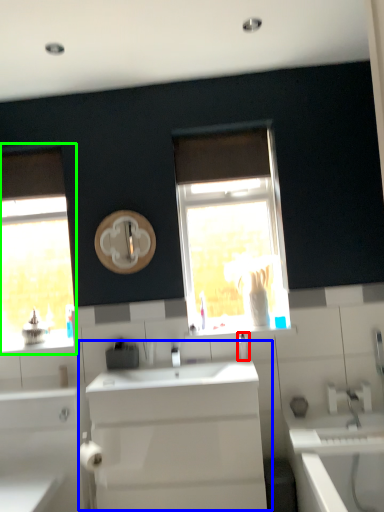
Question: Based on their relative distances, which object is nearer to soap dispenser (highlighted by a red box)? Choose from sink (highlighted by a blue box) and window (highlighted by a green box).

Choices:
 (A) sink
 (B) window

Answer: (A)